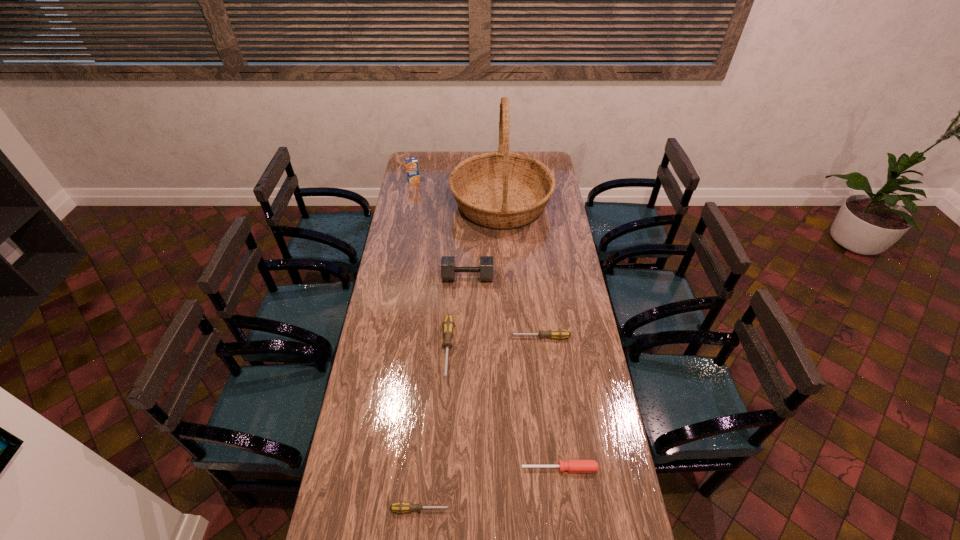
Locate an element on the screen. The image size is (960, 540). basket is located at coordinates (501, 189).

Find the location of a particular element. orange_juice is located at coordinates 412,169.

Find the location of a particular element. Image resolution: width=960 pixels, height=540 pixels. the second tallest object is located at coordinates (412, 169).

Where is `dumbbell`? This screenshot has height=540, width=960. dumbbell is located at coordinates (448, 269).

Image resolution: width=960 pixels, height=540 pixels. I want to click on the third farthest object, so [448, 269].

Where is `the tallest screwdriver`? This screenshot has width=960, height=540. the tallest screwdriver is located at coordinates (448, 325).

Identify the location of the biggest gray screwdriver. The width and height of the screenshot is (960, 540). (448, 325).

Identify the location of the second tallest screwdriver. (559, 334).

I want to click on the fifth tallest object, so click(559, 334).

You are a GUI agent. You are given a task and a screenshot of the screen. Output one action in this format:
    pyautogui.click(x=<x>, y=<y>)
    Task: Click on the sixth farthest object
    The image size is (960, 540).
    Given the screenshot: What is the action you would take?
    point(573,466)